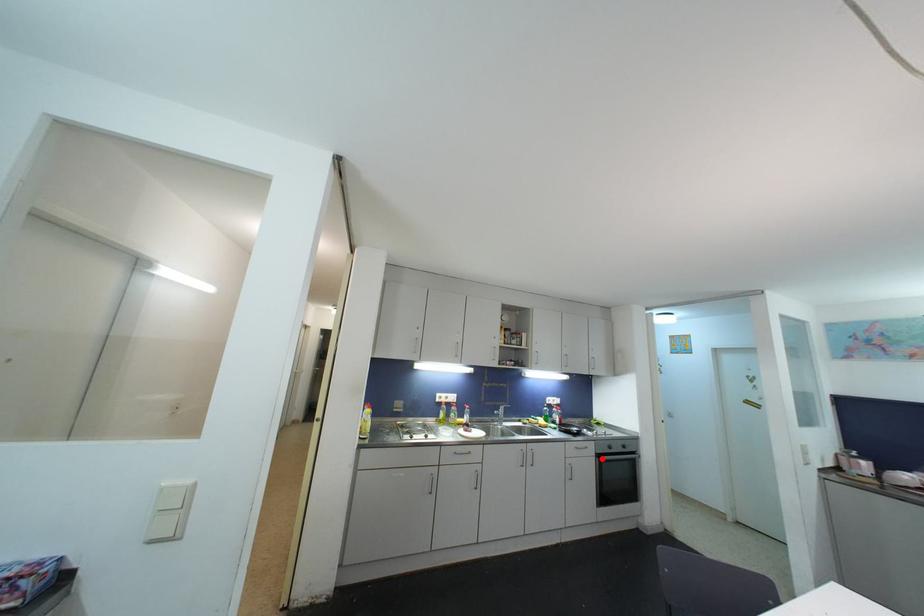
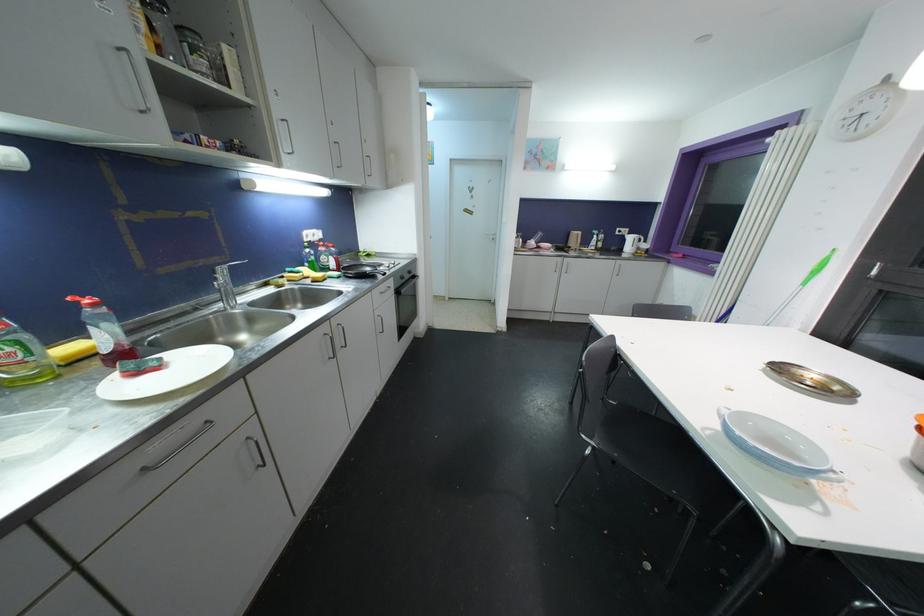
Question: I am providing you with two images of the same scene from different viewpoints. In image1, a red point is highlighted. Considering the same 3D point in image2, which of the following is correct?

Choices:
 (A) It is closer
 (B) It is farther

Answer: (A)